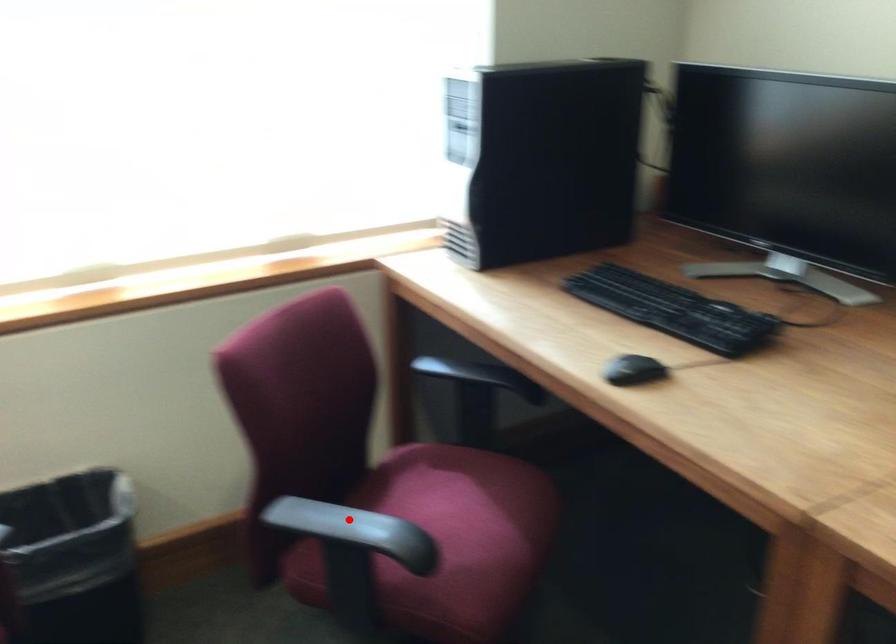
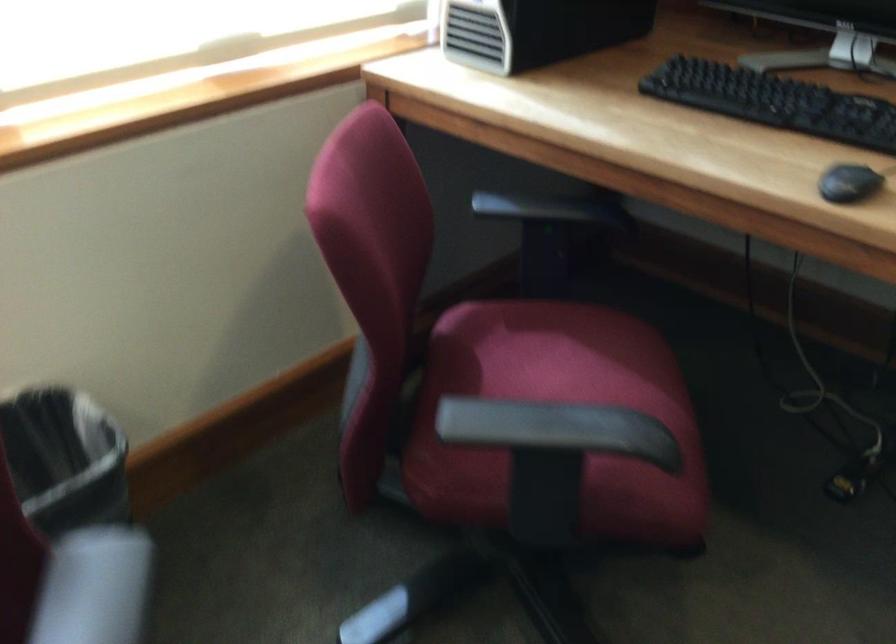
The point at the highlighted location is marked in the first image. Where is the corresponding point in the second image?

(556, 415)